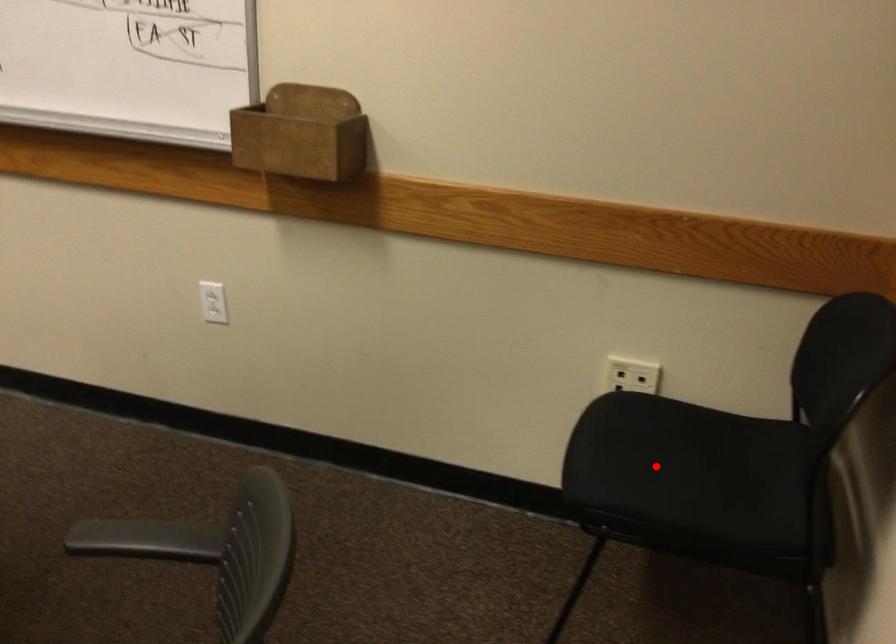
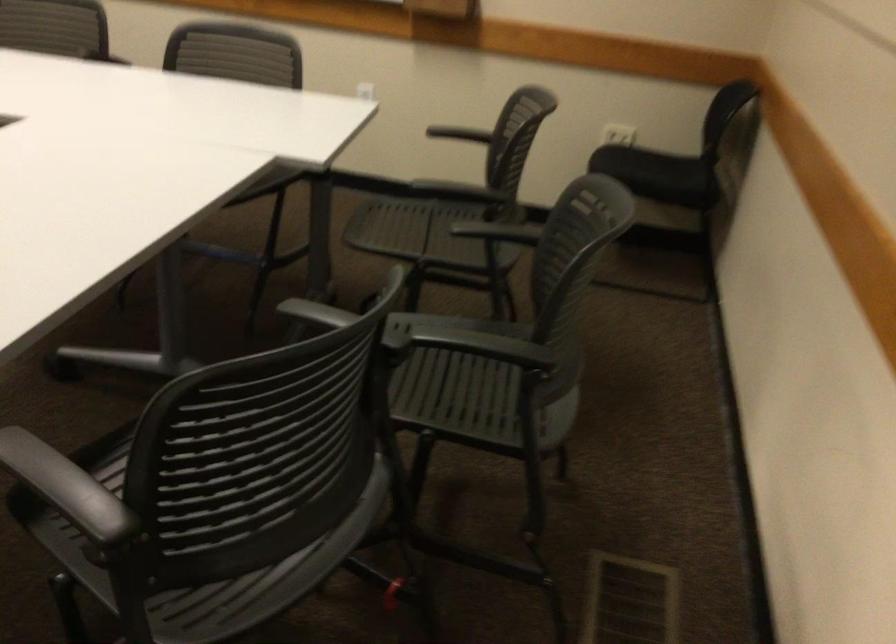
Locate, in the second image, the point that corresponds to the highlighted location in the first image.

(634, 166)